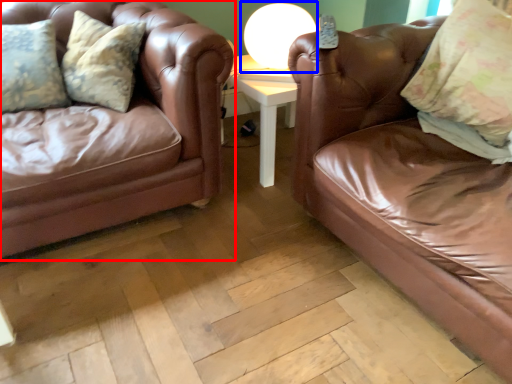
Question: Among these objects, which one is farthest to the camera, studio couch (highlighted by a red box) or table lamp (highlighted by a blue box)?

Choices:
 (A) studio couch
 (B) table lamp

Answer: (B)